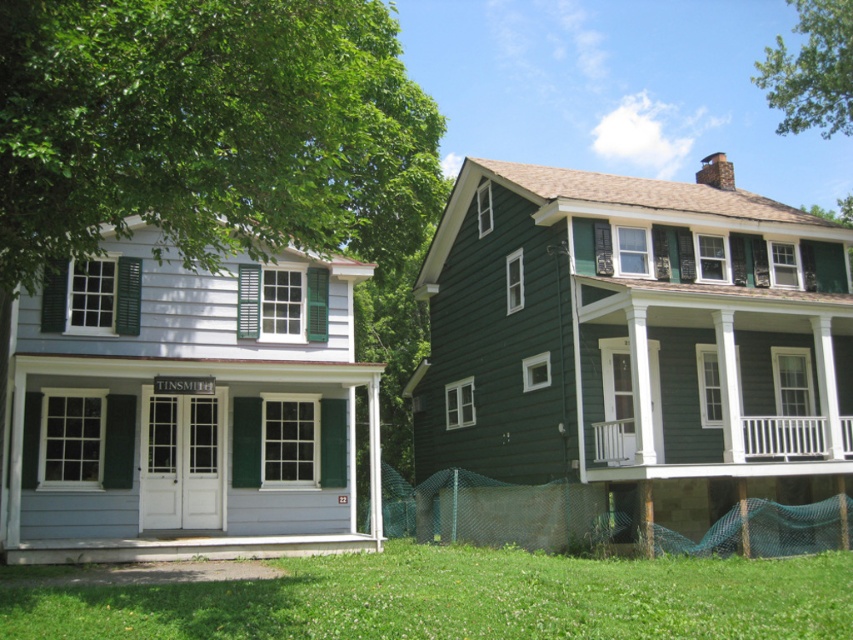
Question: Which point is farther to the camera?

Choices:
 (A) (242, 285)
 (B) (814, 60)
 (C) (299, 122)

Answer: (B)

Question: Estimate the real-world distances between objects in this image. Which object is farther from the green leafy tree at upper right?

Choices:
 (A) white painted wood porch at center
 (B) green painted wood shutter at center

Answer: (A)

Question: Which is nearer to the green leafy tree at upper left?

Choices:
 (A) white painted wood porch at center
 (B) green painted wood shutter at center
 (C) green leafy tree at upper right

Answer: (B)

Question: Is green leafy tree at upper right to the left of white painted wood porch at center from the viewer's perspective?

Choices:
 (A) no
 (B) yes

Answer: (A)

Question: Is green leafy tree at upper left wider than white painted wood porch at center?

Choices:
 (A) no
 (B) yes

Answer: (B)

Question: Does green leafy tree at upper right have a smaller size compared to green painted wood shutter at center?

Choices:
 (A) yes
 (B) no

Answer: (B)